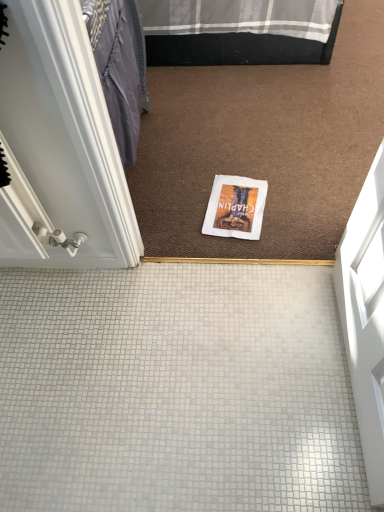
Question: Is the surface of white tile floor at center in direct contact with white paper magazine at center?

Choices:
 (A) no
 (B) yes

Answer: (A)

Question: Is white tile floor at center thinner than white paper magazine at center?

Choices:
 (A) no
 (B) yes

Answer: (A)

Question: Is white tile floor at center wider than white paper magazine at center?

Choices:
 (A) yes
 (B) no

Answer: (A)

Question: Is white tile floor at center further to camera compared to white paper magazine at center?

Choices:
 (A) yes
 (B) no

Answer: (B)

Question: From the image's perspective, is white tile floor at center under white paper magazine at center?

Choices:
 (A) no
 (B) yes

Answer: (B)

Question: Is point (3, 270) positioned closer to the camera than point (92, 52)?

Choices:
 (A) closer
 (B) farther

Answer: (B)

Question: From a real-world perspective, is white tile floor at center positioned above or below white glossy door at left?

Choices:
 (A) above
 (B) below

Answer: (B)

Question: Would you say white tile floor at center is inside or outside white glossy door at left?

Choices:
 (A) outside
 (B) inside

Answer: (A)

Question: From their relative heights in the image, would you say white tile floor at center is taller or shorter than white glossy door at left?

Choices:
 (A) tall
 (B) short

Answer: (B)

Question: Does point (1, 468) appear closer or farther from the camera than point (228, 224)?

Choices:
 (A) farther
 (B) closer

Answer: (B)

Question: Looking at their shapes, would you say white tile floor at center is wider or thinner than white paper magazine at center?

Choices:
 (A) thin
 (B) wide

Answer: (B)

Question: From their relative heights in the image, would you say white tile floor at center is taller or shorter than white paper magazine at center?

Choices:
 (A) short
 (B) tall

Answer: (B)

Question: Is white tile floor at center bigger or smaller than white paper magazine at center?

Choices:
 (A) small
 (B) big

Answer: (B)

Question: Is white glossy door at left taller or shorter than white tile floor at center?

Choices:
 (A) short
 (B) tall

Answer: (B)

Question: From a real-world perspective, is white glossy door at left above or below white tile floor at center?

Choices:
 (A) below
 (B) above

Answer: (B)